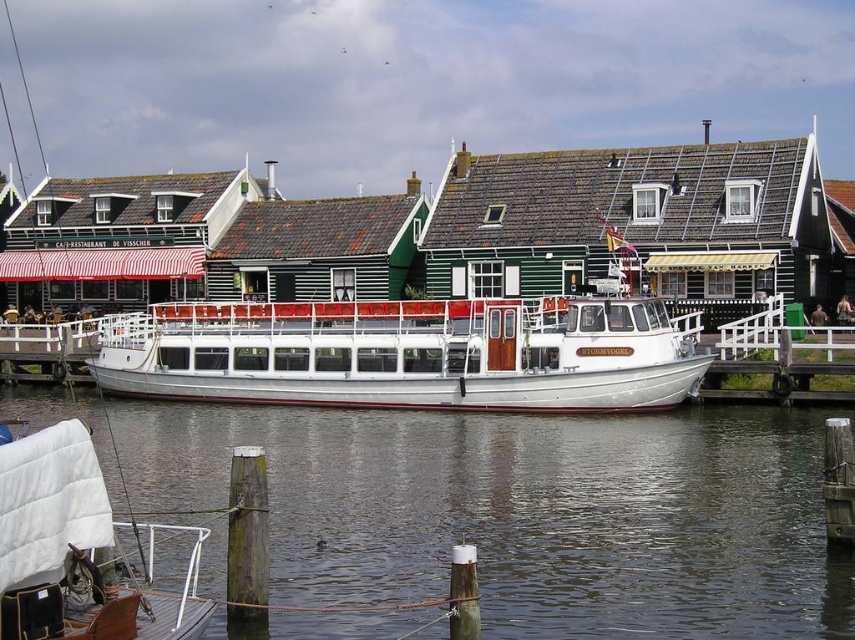
Question: From the image, what is the correct spatial relationship of clear water at lower center in relation to white polished wood boat at center?

Choices:
 (A) left
 (B) right

Answer: (B)

Question: Which object appears farthest from the camera in this image?

Choices:
 (A) clear water at lower center
 (B) white polished wood boat at center

Answer: (B)

Question: Among these points, which one is farthest from the camera?

Choices:
 (A) (594, 323)
 (B) (361, 493)

Answer: (A)

Question: Is clear water at lower center to the right of white polished wood boat at center from the viewer's perspective?

Choices:
 (A) no
 (B) yes

Answer: (B)

Question: Can you confirm if clear water at lower center is positioned above white polished wood boat at center?

Choices:
 (A) yes
 (B) no

Answer: (B)